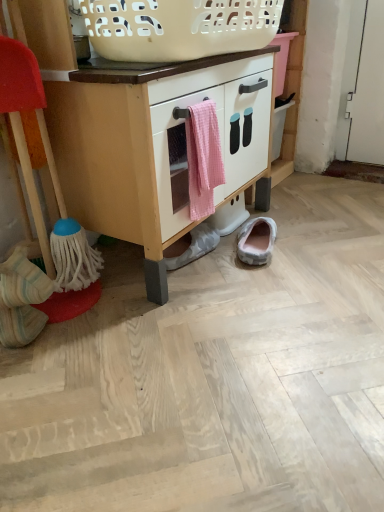
Image resolution: width=384 pixels, height=512 pixels. What are the coordinates of `white matte cabinet at center` in the screenshot? It's located at (149, 133).

Measure the distance between point (129,40) and camera.

The depth of point (129,40) is 35.98 inches.

Measure the distance between point (249, 234) and camera.

The distance of point (249, 234) from camera is 4.58 feet.

This screenshot has height=512, width=384. What do you see at coordinates (256, 240) in the screenshot?
I see `gray suede slipper at lower center, positioned as the 1th footwear in back-to-front order` at bounding box center [256, 240].

Where is `white matte cabinet at center`? The image size is (384, 512). white matte cabinet at center is located at coordinates pyautogui.click(x=149, y=133).

Find the location of a particular element. cabinetry above the white striped socks at lower left, which is the 1th footwear in left-to-right order (from a real-world perspective) is located at coordinates (149, 133).

Is white matte cabinet at center with white striped socks at lower left, the 3th footwear when ordered from right to left?

white matte cabinet at center and white striped socks at lower left, the 3th footwear when ordered from right to left, are clearly separated.

Who is taller, white matte cabinet at center or white striped socks at lower left, which is the 1th footwear in left-to-right order?

white matte cabinet at center.

From a real-world perspective, which is physically below, white matte cabinet at center or white striped socks at lower left, the 3th footwear when ordered from right to left?

white striped socks at lower left, the 3th footwear when ordered from right to left, is physically lower.

From a real-world perspective, is white plastic basket at upper center beneath gray suede slipper at lower center, arranged as the first footwear when viewed from the right?

No.

From the image's perspective, between white plastic basket at upper center and gray suede slipper at lower center, positioned as the 1th footwear in back-to-front order, which one is located above?

white plastic basket at upper center.

Can you confirm if white plastic basket at upper center is taller than gray suede slipper at lower center, positioned as the 1th footwear in back-to-front order?

Indeed, white plastic basket at upper center has a greater height compared to gray suede slipper at lower center, positioned as the 1th footwear in back-to-front order.

Considering the relative sizes of gray suede slipper at lower center, arranged as the first footwear when viewed from the right, and gray fabric slipper at lower center, positioned as the second footwear in front-to-back order, in the image provided, is gray suede slipper at lower center, arranged as the first footwear when viewed from the right, smaller than gray fabric slipper at lower center, positioned as the second footwear in front-to-back order,?

Actually, gray suede slipper at lower center, arranged as the first footwear when viewed from the right, might be larger than gray fabric slipper at lower center, positioned as the second footwear in front-to-back order.

Starting from the gray suede slipper at lower center, which is the third footwear from front to back, which footwear is the 1st one in front? Please provide its 2D coordinates.

[(191, 246)]

Which is behind, gray suede slipper at lower center, positioned as the 1th footwear in back-to-front order, or gray fabric slipper at lower center, placed as the 2th footwear when sorted from left to right?

gray suede slipper at lower center, positioned as the 1th footwear in back-to-front order, is behind.

Does point (49, 294) appear closer or farther from the camera than point (227, 124)?

Point (49, 294) is positioned closer to the camera compared to point (227, 124).

From a real-world perspective, who is located higher, white striped socks at lower left, which is the 1th footwear in left-to-right order, or white matte cabinet at center?

white matte cabinet at center, from a real-world perspective.

Is white striped socks at lower left, which is the 1th footwear in left-to-right order, situated inside white matte cabinet at center or outside?

white striped socks at lower left, which is the 1th footwear in left-to-right order, cannot be found inside white matte cabinet at center.

Is white striped socks at lower left, which ranks as the third footwear in back-to-front order, thinner than white matte cabinet at center?

Yes.

Does white striped socks at lower left, acting as the 1th footwear starting from the front, appear on the left side of white plastic basket at upper center?

Yes, white striped socks at lower left, acting as the 1th footwear starting from the front, is to the left of white plastic basket at upper center.

Does white striped socks at lower left, which ranks as the third footwear in back-to-front order, lie in front of white plastic basket at upper center?

No, it is behind white plastic basket at upper center.

Between white striped socks at lower left, which is the 1th footwear in left-to-right order, and white plastic basket at upper center, which one has more height?

With more height is white striped socks at lower left, which is the 1th footwear in left-to-right order.

Considering the points (13, 263) and (167, 22), which point is behind, point (13, 263) or point (167, 22)?

Positioned behind is point (13, 263).

Is gray suede slipper at lower center, acting as the third footwear starting from the left, not close to white plastic basket at upper center?

That's not correct — gray suede slipper at lower center, acting as the third footwear starting from the left, is a little close to white plastic basket at upper center.

Looking at this image, which of these two, gray suede slipper at lower center, arranged as the first footwear when viewed from the right, or white plastic basket at upper center, stands shorter?

gray suede slipper at lower center, arranged as the first footwear when viewed from the right, is shorter.

Based on the photo, considering the sizes of gray suede slipper at lower center, positioned as the 1th footwear in back-to-front order, and white plastic basket at upper center in the image, is gray suede slipper at lower center, positioned as the 1th footwear in back-to-front order, wider or thinner than white plastic basket at upper center?

Clearly, gray suede slipper at lower center, positioned as the 1th footwear in back-to-front order, has less width compared to white plastic basket at upper center.

From a real-world perspective, who is located lower, gray suede slipper at lower center, acting as the third footwear starting from the left, or white plastic basket at upper center?

In real-world perspective, gray suede slipper at lower center, acting as the third footwear starting from the left, is lower.

From a real-world perspective, is gray fabric slipper at lower center, placed as the 2th footwear when sorted from left to right, physically above white striped socks at lower left, acting as the 1th footwear starting from the front?

No, from a real-world perspective, gray fabric slipper at lower center, placed as the 2th footwear when sorted from left to right, is not over white striped socks at lower left, acting as the 1th footwear starting from the front

How many degrees apart are the facing directions of gray fabric slipper at lower center, which is counted as the second footwear, starting from the right, and white striped socks at lower left, the 3th footwear when ordered from right to left?

The angle between the facing direction of gray fabric slipper at lower center, which is counted as the second footwear, starting from the right, and the facing direction of white striped socks at lower left, the 3th footwear when ordered from right to left, is 36.2 degrees.

Is point (172, 263) positioned after point (36, 286)?

Yes, it is behind point (36, 286).

Considering the positions of objects gray fabric slipper at lower center, the second footwear when ordered from back to front, and white striped socks at lower left, which is the 1th footwear in left-to-right order, in the image provided, who is more to the left, gray fabric slipper at lower center, the second footwear when ordered from back to front, or white striped socks at lower left, which is the 1th footwear in left-to-right order,?

white striped socks at lower left, which is the 1th footwear in left-to-right order.

Image resolution: width=384 pixels, height=512 pixels. In order to click on footwear on the left of the white matte cabinet at center in this screenshot , I will do `click(23, 281)`.

Where is `footwear that is the 1st one when counting downward from the white plastic basket at upper center (from the image's perspective)`? This screenshot has width=384, height=512. footwear that is the 1st one when counting downward from the white plastic basket at upper center (from the image's perspective) is located at coordinates (256, 240).

When comparing their distances from gray fabric slipper at lower center, placed as the 2th footwear when sorted from left to right, does gray suede slipper at lower center, acting as the third footwear starting from the left, or pink gingham towel at center seem further?

pink gingham towel at center.

Consider the image. Which object lies nearer to the anchor point gray fabric slipper at lower center, the second footwear when ordered from back to front, white striped socks at lower left, the 3th footwear when ordered from right to left, or gray suede slipper at lower center, acting as the third footwear starting from the left?

gray suede slipper at lower center, acting as the third footwear starting from the left, is closer to gray fabric slipper at lower center, the second footwear when ordered from back to front.

Looking at the image, which one is located closer to white plastic basket at upper center, white matte cabinet at center or gray fabric slipper at lower center, which is counted as the second footwear, starting from the right?

The object closer to white plastic basket at upper center is white matte cabinet at center.

From the picture: Considering their positions, is white striped socks at lower left, which ranks as the third footwear in back-to-front order, positioned closer to gray suede slipper at lower center, positioned as the 1th footwear in back-to-front order, than gray fabric slipper at lower center, which is counted as the second footwear, starting from the right?

The object closer to gray suede slipper at lower center, positioned as the 1th footwear in back-to-front order, is gray fabric slipper at lower center, which is counted as the second footwear, starting from the right.

Which object lies further to the anchor point white plastic basket at upper center, white matte cabinet at center or gray suede slipper at lower center, positioned as the 1th footwear in back-to-front order?

gray suede slipper at lower center, positioned as the 1th footwear in back-to-front order, is further to white plastic basket at upper center.

Looking at the image, which one is located further to white striped socks at lower left, the 3th footwear when ordered from right to left, white matte cabinet at center or gray suede slipper at lower center, which is the third footwear from front to back?

gray suede slipper at lower center, which is the third footwear from front to back, is further to white striped socks at lower left, the 3th footwear when ordered from right to left.

When comparing their distances from gray suede slipper at lower center, positioned as the 1th footwear in back-to-front order, does white matte cabinet at center or white plastic basket at upper center seem further?

white plastic basket at upper center is positioned further to the anchor gray suede slipper at lower center, positioned as the 1th footwear in back-to-front order.

Looking at the image, which one is located further to white matte cabinet at center, gray suede slipper at lower center, positioned as the 1th footwear in back-to-front order, or white plastic basket at upper center?

gray suede slipper at lower center, positioned as the 1th footwear in back-to-front order, is further to white matte cabinet at center.

In order to click on drawer between white matte cabinet at center and gray fabric slipper at lower center, which is counted as the second footwear, starting from the right, in the front-back direction in this screenshot , I will do `click(177, 157)`.

Locate an element on the screen. drawer that lies between white plastic basket at upper center and white striped socks at lower left, the 3th footwear when ordered from right to left, from top to bottom is located at coordinates (177, 157).

At what (x,y) coordinates should I click in order to perform the action: click on cabinetry between white striped socks at lower left, which is the 1th footwear in left-to-right order, and gray suede slipper at lower center, positioned as the 1th footwear in back-to-front order, in the horizontal direction. Please return your answer as a coordinate pair (x, y). The width and height of the screenshot is (384, 512). Looking at the image, I should click on (149, 133).

Where is `footwear between pink gingham towel at center and gray suede slipper at lower center, which is the third footwear from front to back, along the z-axis`? footwear between pink gingham towel at center and gray suede slipper at lower center, which is the third footwear from front to back, along the z-axis is located at coordinates (191, 246).